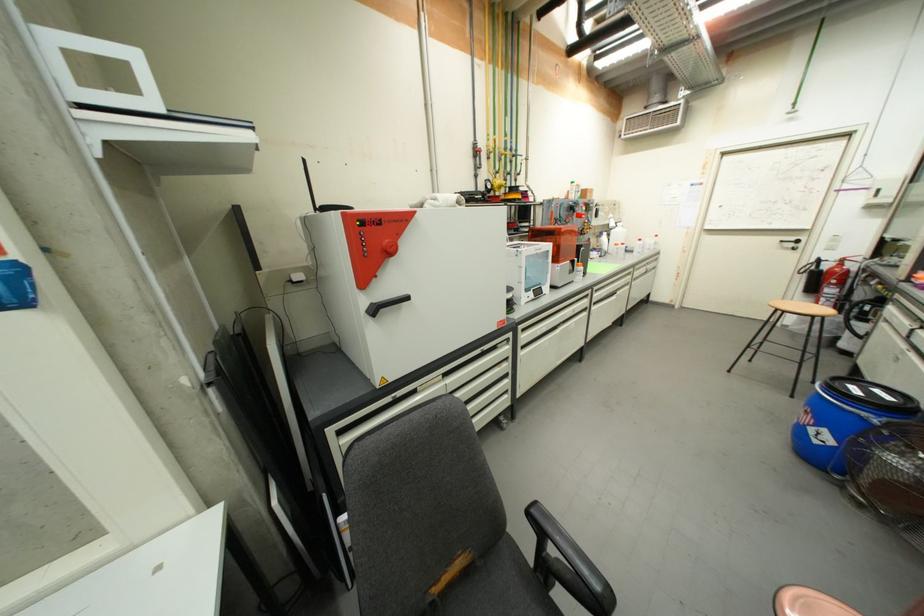
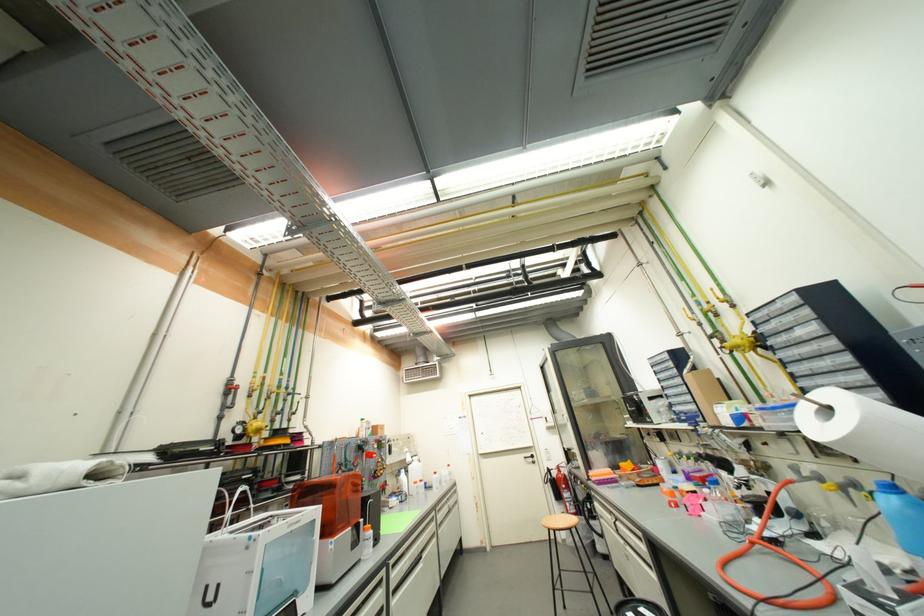
Where in the second image is the point corresponding to point 857,277 from the first image?

(574, 480)